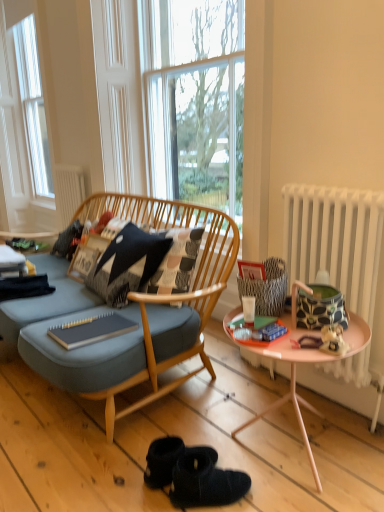
Question: From the image's perspective, is black textured pillow at center above or below clear glass window at center?

Choices:
 (A) above
 (B) below

Answer: (B)

Question: Considering the positions of black textured pillow at center and clear glass window at center in the image, is black textured pillow at center wider or thinner than clear glass window at center?

Choices:
 (A) wide
 (B) thin

Answer: (A)

Question: Which object is positioned closest to the matte green magazine at center, the 1th magazine in the right-to-left sequence?

Choices:
 (A) white matte radiator at upper center, which is the second radiator from front to back
 (B) black suede booties at lower center
 (C) matte gray notebook at center, placed as the 1th magazine when sorted from left to right
 (D) clear glass window at center
 (E) white radiator at right, the 2th radiator from the left

Answer: (E)

Question: Based on their relative distances, which object is nearer to the clear glass window at center?

Choices:
 (A) black textured pillow at center
 (B) matte gray notebook at center, placed as the 1th magazine when sorted from left to right
 (C) black suede booties at lower center
 (D) white matte radiator at upper center, the second radiator ordered from the bottom
 (E) white glossy cup at center

Answer: (A)